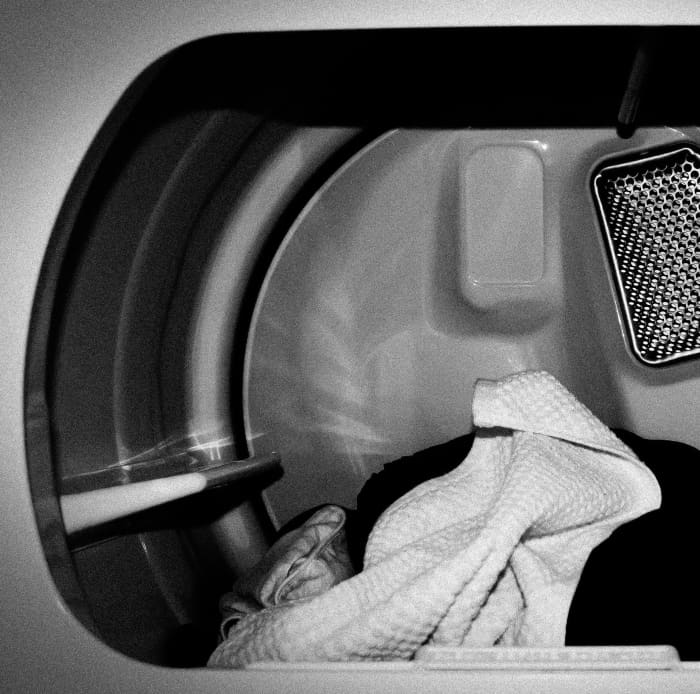
At what (x,y) coordinates should I click in order to perform the action: click on drum in dryer. Please return your answer as a coordinate pair (x, y). Looking at the image, I should click on (168, 370), (192, 595).